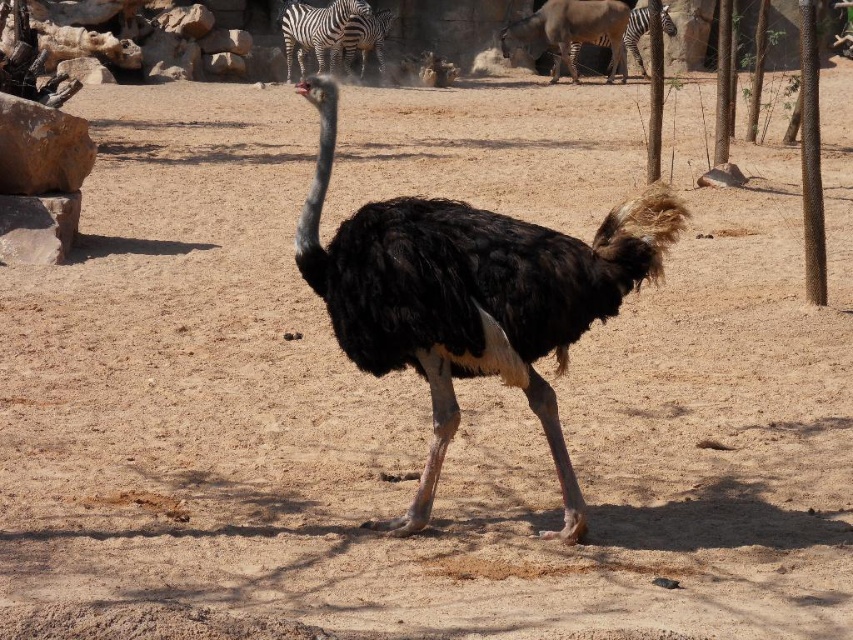
Does black feathered ostrich at center have a lesser width compared to brown rough bark tree at right?

Yes.

Identify the location of black feathered ostrich at center. (x=469, y=296).

The image size is (853, 640). In order to click on black feathered ostrich at center in this screenshot , I will do `click(469, 296)`.

Does black feathered ostrich at center appear on the left side of brown textured pole at right?

Indeed, black feathered ostrich at center is positioned on the left side of brown textured pole at right.

Can you confirm if black feathered ostrich at center is shorter than brown textured pole at right?

No, black feathered ostrich at center is not shorter than brown textured pole at right.

This screenshot has height=640, width=853. Identify the location of black feathered ostrich at center. (469, 296).

Who is more distant from viewer, (x=811, y=161) or (x=363, y=51)?

Point (x=363, y=51)

Is point (811, 140) farther from viewer compared to point (386, 24)?

No.

Where is `brown textured pole at right`? brown textured pole at right is located at coordinates (811, 160).

Where is `brown textured pole at right`? brown textured pole at right is located at coordinates pyautogui.click(x=811, y=160).